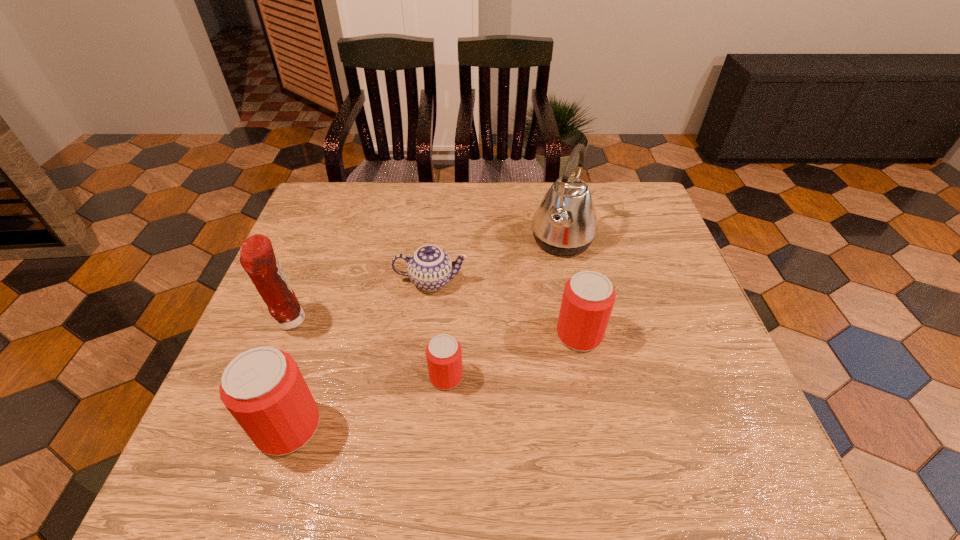
In order to click on vacant region at the far edge of the desktop in this screenshot , I will do `click(463, 225)`.

The width and height of the screenshot is (960, 540). In the image, there is a desktop. In order to click on vacant space at the near edge in this screenshot , I will do `click(526, 414)`.

In the image, there is a desktop. Where is `vacant space at the left edge`? This screenshot has height=540, width=960. vacant space at the left edge is located at coordinates (293, 267).

Locate an element on the screen. vacant space at the right edge of the desktop is located at coordinates (651, 330).

The height and width of the screenshot is (540, 960). In the image, there is a desktop. What are the coordinates of `vacant space at the far left corner` in the screenshot? It's located at (360, 185).

Identify the location of free spot between the tallest object and the second farthest object. (497, 261).

The image size is (960, 540). Find the location of `vacant space in between the fifth shortest object and the fourth tallest object`. vacant space in between the fifth shortest object and the fourth tallest object is located at coordinates (435, 328).

You are a GUI agent. You are given a task and a screenshot of the screen. Output one action in this format:
    pyautogui.click(x=<x>, y=<y>)
    Task: Click on the free spot between the rightmost beer can and the fifth shortest object
    
    Given the screenshot: What is the action you would take?
    point(435,328)

The image size is (960, 540). What are the coordinates of `object that stands as the fourth closest to the second tallest object` in the screenshot? It's located at (565, 224).

Identify the location of object that can be found as the fourth closest to the second tallest beer can. The image size is (960, 540). (263, 388).